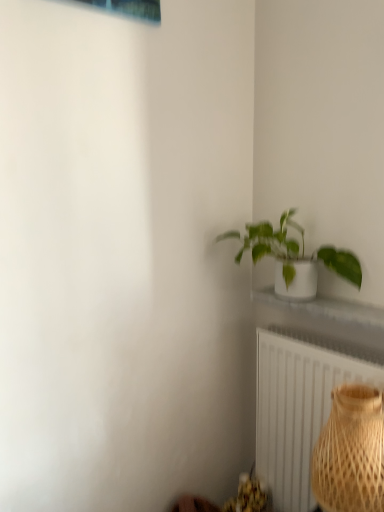
Question: Is green glossy plant at upper right with white textured radiator at lower right?

Choices:
 (A) yes
 (B) no

Answer: (B)

Question: From the image's perspective, is green glossy plant at upper right under white textured radiator at lower right?

Choices:
 (A) no
 (B) yes

Answer: (A)

Question: Is green glossy plant at upper right in front of white textured radiator at lower right?

Choices:
 (A) no
 (B) yes

Answer: (B)

Question: From a real-world perspective, is green glossy plant at upper right located higher than white textured radiator at lower right?

Choices:
 (A) yes
 (B) no

Answer: (A)

Question: Is green glossy plant at upper right completely or partially outside of white textured radiator at lower right?

Choices:
 (A) no
 (B) yes

Answer: (B)

Question: From a real-world perspective, is bamboo textured vase at lower right positioned above or below green glossy plant at upper right?

Choices:
 (A) below
 (B) above

Answer: (A)

Question: Considering their positions, is bamboo textured vase at lower right located in front of or behind green glossy plant at upper right?

Choices:
 (A) behind
 (B) front

Answer: (B)

Question: Is point (339, 456) closer or farther from the camera than point (352, 256)?

Choices:
 (A) farther
 (B) closer

Answer: (B)

Question: Is bamboo textured vase at lower right bigger or smaller than green glossy plant at upper right?

Choices:
 (A) small
 (B) big

Answer: (A)

Question: Is point (286, 224) positioned closer to the camera than point (357, 422)?

Choices:
 (A) closer
 (B) farther

Answer: (B)

Question: From a real-world perspective, is green glossy plant at upper right physically located above or below bamboo textured vase at lower right?

Choices:
 (A) below
 (B) above

Answer: (B)

Question: Would you say green glossy plant at upper right is to the left or to the right of bamboo textured vase at lower right in the picture?

Choices:
 (A) left
 (B) right

Answer: (A)

Question: Based on their sizes in the image, would you say green glossy plant at upper right is bigger or smaller than bamboo textured vase at lower right?

Choices:
 (A) small
 (B) big

Answer: (B)

Question: From the image's perspective, relative to white textured radiator at lower right, is green glossy plant at upper right above or below?

Choices:
 (A) below
 (B) above

Answer: (B)

Question: Relative to white textured radiator at lower right, is green glossy plant at upper right in front or behind?

Choices:
 (A) behind
 (B) front

Answer: (B)